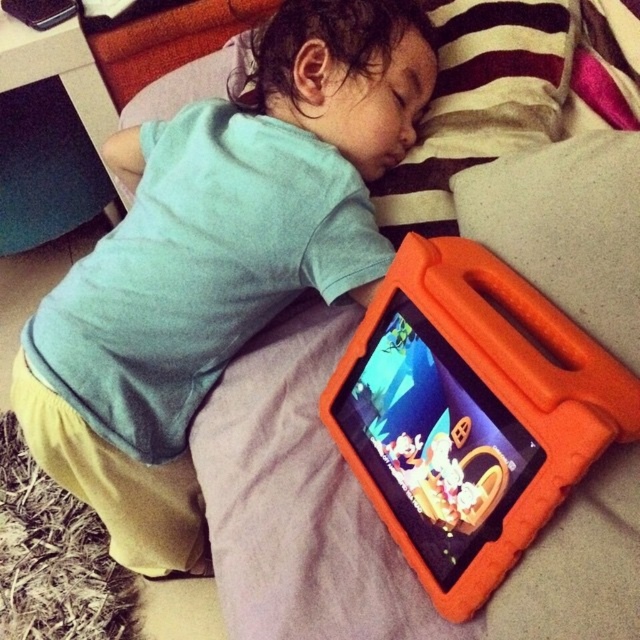
Question: Is matte orange tablet at lower right in front of orange foam pillow at center?

Choices:
 (A) no
 (B) yes

Answer: (A)

Question: Which point is farther from the camera taking this photo?

Choices:
 (A) (280, 172)
 (B) (504, 164)

Answer: (A)

Question: Which of the following is the farthest from the observer?

Choices:
 (A) (392, 292)
 (B) (328, 192)
 (C) (545, 257)

Answer: (B)

Question: Which point is closer to the camera?

Choices:
 (A) orange foam tablet at lower right
 (B) orange foam pillow at center
 (C) matte orange tablet at lower right

Answer: (A)

Question: Is matte orange tablet at lower right closer to the viewer compared to orange foam tablet at lower right?

Choices:
 (A) yes
 (B) no

Answer: (B)

Question: Is orange foam tablet at lower right thinner than orange foam pillow at center?

Choices:
 (A) no
 (B) yes

Answer: (A)